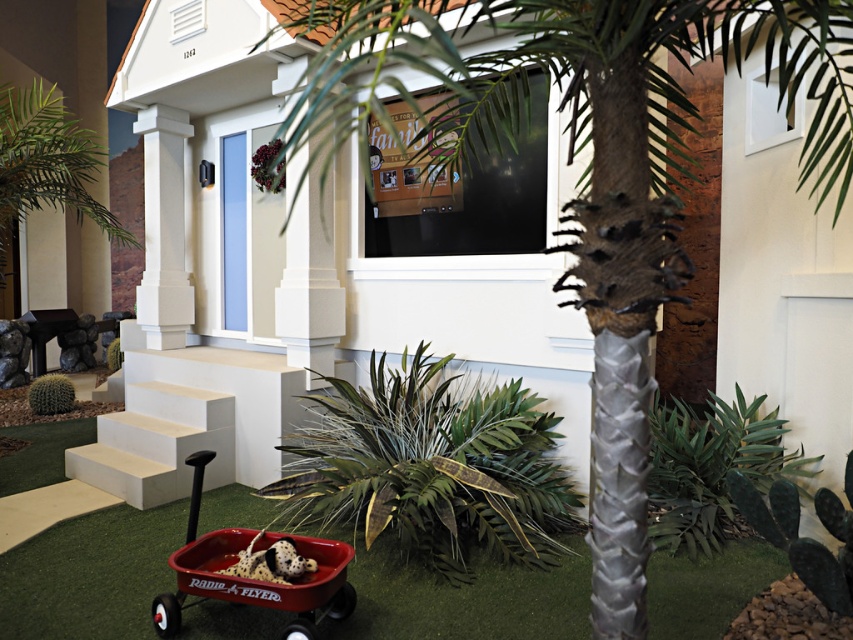
You are a child playing on the miniature house porch. You want to move the red plastic wagon at lower left to the top of the white smooth stairs at lower left. Is it possible to push the wagon up the stairs without lifting it?

The red plastic wagon at lower left is in front of the white smooth stairs at lower left, so it is positioned closer to the base of the stairs. Since the wagon is already at the base, it can be pushed up the stairs without lifting it.

You are a visitor at a model house exhibit and notice the silver textured palm tree at center and the green artificial turf at lower center. Based on their positions, which object is closer to the right edge of the display?

The silver textured palm tree at center is closer to the right edge of the display because it is positioned to the right of the green artificial turf at lower center.